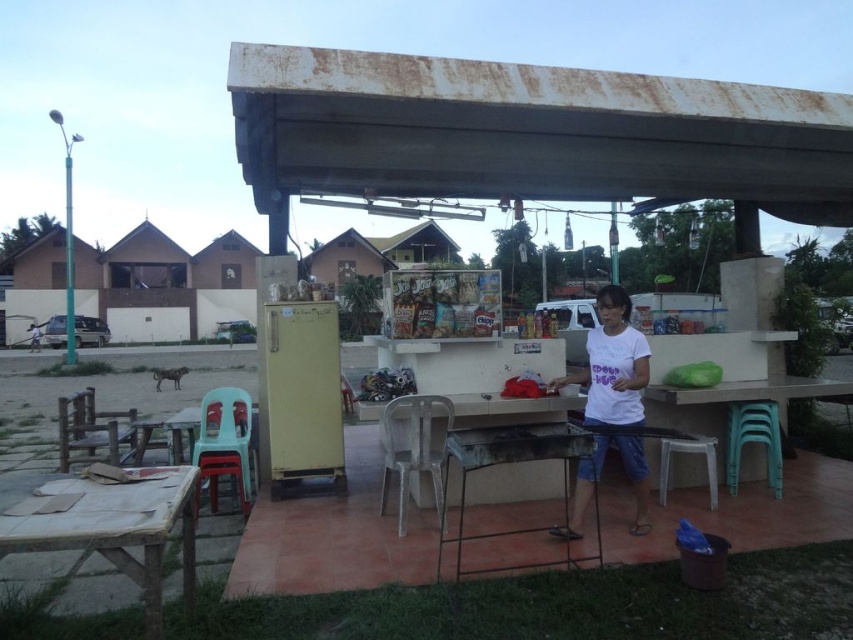
Looking at this image, who is lower down, green plastic table at center or metallic gray grill at center?

metallic gray grill at center

Is green plastic table at center above metallic gray grill at center?

Yes, green plastic table at center is above metallic gray grill at center.

Does point (683, 470) come farther from viewer compared to point (572, 461)?

That is False.

Locate an element on the screen. This screenshot has width=853, height=640. green plastic table at center is located at coordinates (728, 403).

Is point (688, 422) farther from viewer compared to point (663, 500)?

Yes, point (688, 422) is behind point (663, 500).

Does point (653, 460) lie in front of point (712, 448)?

No.

Which is behind, point (708, 419) or point (671, 445)?

The point (708, 419) is behind.

Where is `green plastic table at center`? The image size is (853, 640). green plastic table at center is located at coordinates (728, 403).

Can you confirm if metallic gray grill at center is positioned above white plastic stool at lower right?

Actually, metallic gray grill at center is below white plastic stool at lower right.

Can you confirm if metallic gray grill at center is wider than white plastic stool at lower right?

Indeed, metallic gray grill at center has a greater width compared to white plastic stool at lower right.

Does point (579, 424) come behind point (712, 509)?

Yes, point (579, 424) is behind point (712, 509).

This screenshot has height=640, width=853. What are the coordinates of `metallic gray grill at center` in the screenshot? It's located at (511, 461).